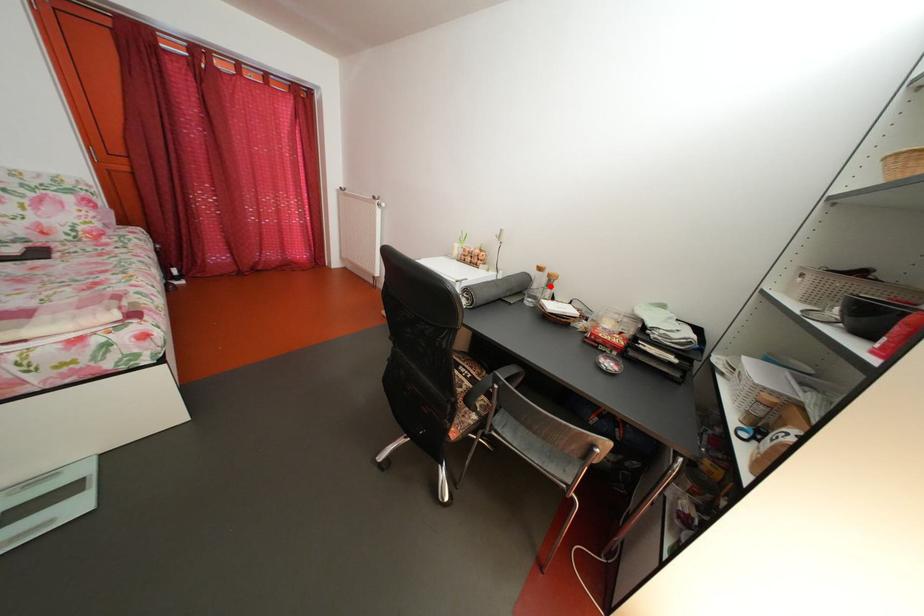
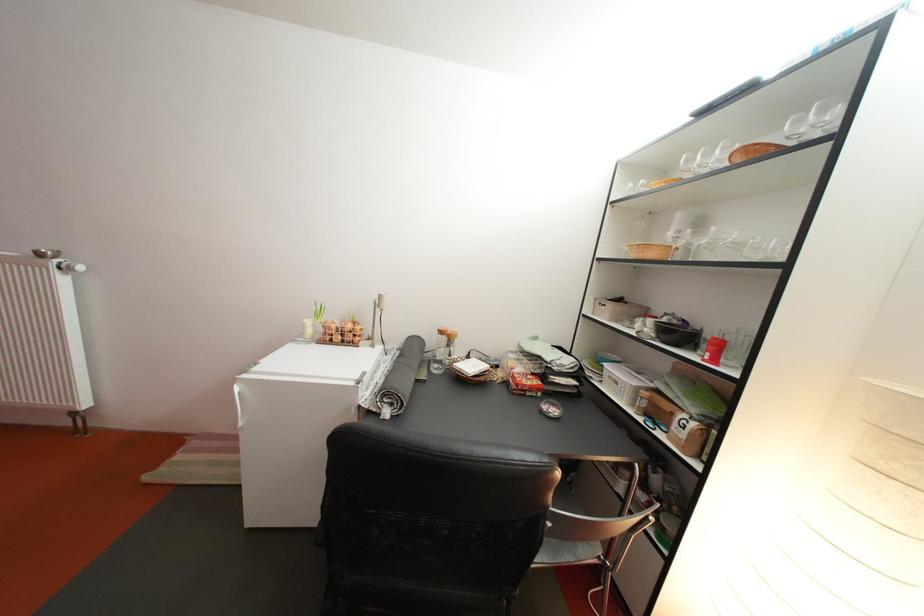
The point at the highlighted location is marked in the first image. Where is the corresponding point in the second image?

(444, 346)